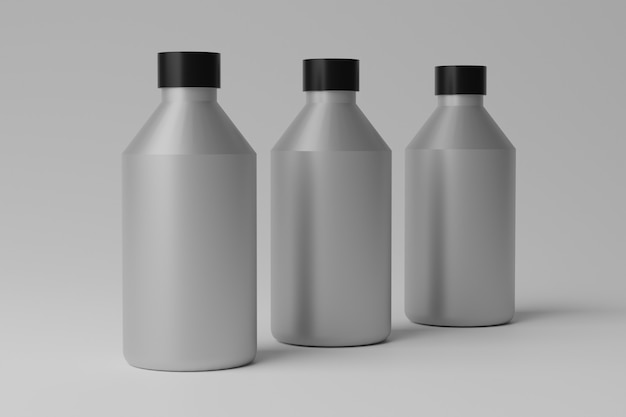
I want to click on bottles with lids, so [203, 86], [326, 86], [481, 114], [466, 90].